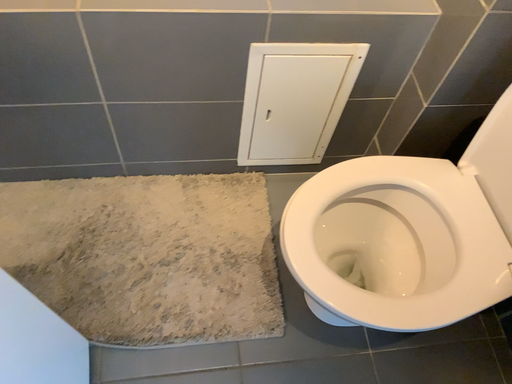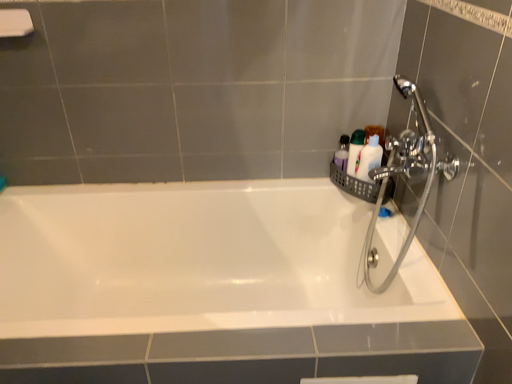
Question: How did the camera likely rotate when shooting the video?

Choices:
 (A) rotated downward
 (B) rotated upward

Answer: (B)